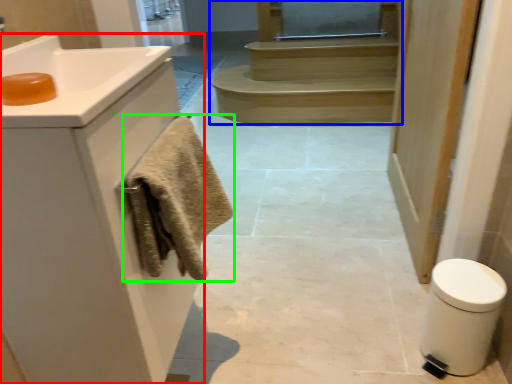
Question: Which is nearer to the bathroom cabinet (highlighted by a red box)? stairs (highlighted by a blue box) or bath towel (highlighted by a green box).

Choices:
 (A) stairs
 (B) bath towel

Answer: (B)